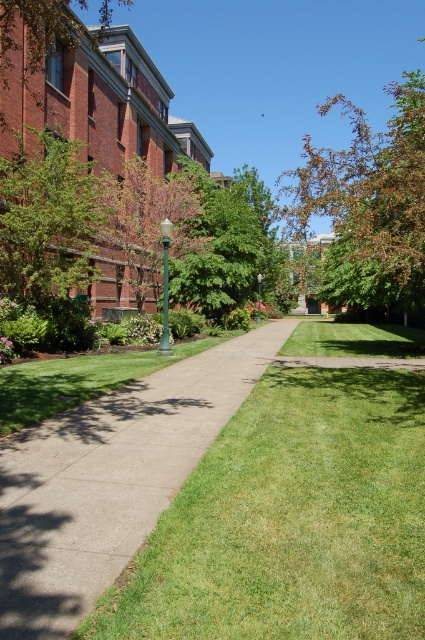
Does green leafy tree at left have a lesser width compared to brown wood tree at upper left?

Yes, green leafy tree at left is thinner than brown wood tree at upper left.

Between green leafy tree at left and brown wood tree at upper left, which one is positioned lower?

green leafy tree at left is lower down.

Find the location of `green leafy tree at left`. green leafy tree at left is located at coordinates (48, 218).

Is point (302, 220) positioned after point (150, 221)?

No, it is in front of (150, 221).

Can you confirm if brown leafy tree at upper center is positioned to the left of green leafy tree at center?

In fact, brown leafy tree at upper center is to the right of green leafy tree at center.

Does point (346, 288) come in front of point (155, 285)?

Yes, it is.

You are a GUI agent. You are given a task and a screenshot of the screen. Output one action in this format:
    pyautogui.click(x=<x>, y=<y>)
    Task: Click on the brown leafy tree at upper center
    This screenshot has width=425, height=640.
    Given the screenshot: What is the action you would take?
    pyautogui.click(x=368, y=202)

Is brown leafy tree at upper center shorter than green leafy tree at left?

No.

Is point (309, 147) closer to viewer compared to point (19, 196)?

No, (309, 147) is further to viewer.

Looking at this image, who is more distant from viewer, (422, 172) or (70, 220)?

Positioned behind is point (70, 220).

Where is `brown leafy tree at upper center`? brown leafy tree at upper center is located at coordinates (368, 202).